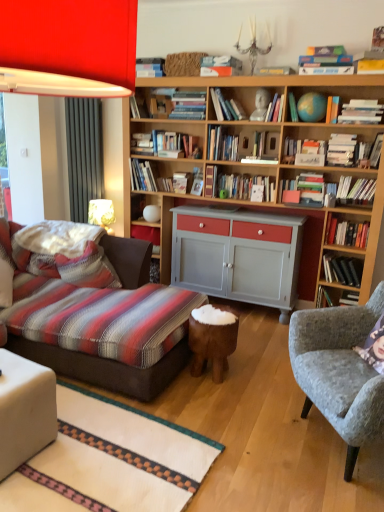
Identify the location of empty space that is ontop of white fabric ottoman at lower left (from a real-world perspective). (11, 370).